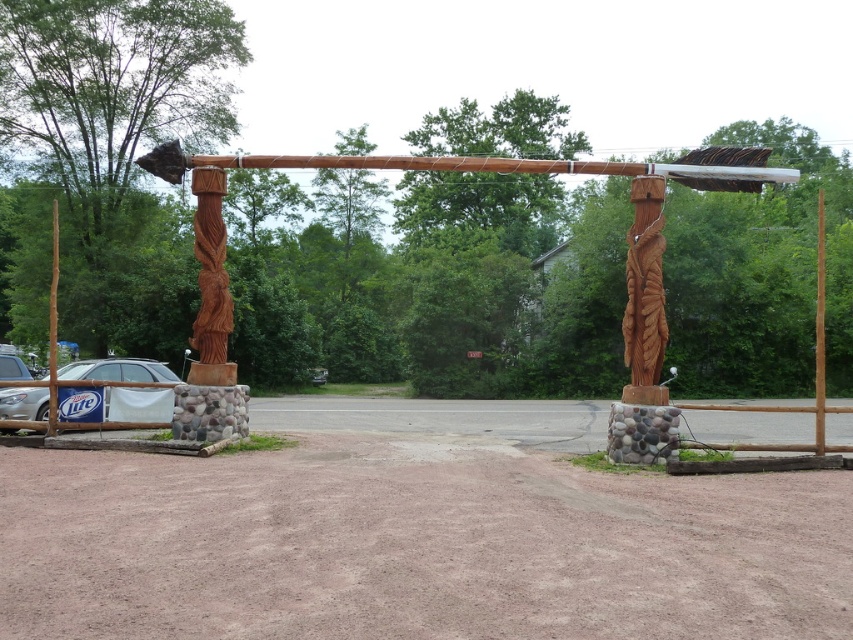
Question: Can you confirm if brown gravel dirt track at center is positioned to the left of silver metallic car at lower left?

Choices:
 (A) no
 (B) yes

Answer: (A)

Question: Is brown gravel dirt track at center positioned behind silver metallic car at lower left?

Choices:
 (A) yes
 (B) no

Answer: (B)

Question: Is brown gravel dirt track at center smaller than silver metallic car at lower left?

Choices:
 (A) yes
 (B) no

Answer: (A)

Question: Which point appears closest to the camera in this image?

Choices:
 (A) (825, 608)
 (B) (111, 374)

Answer: (A)